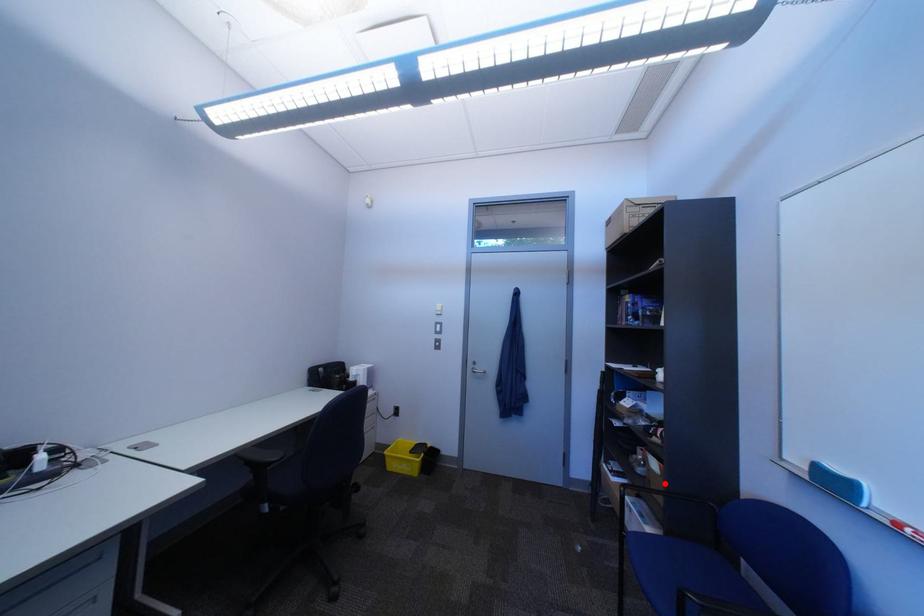
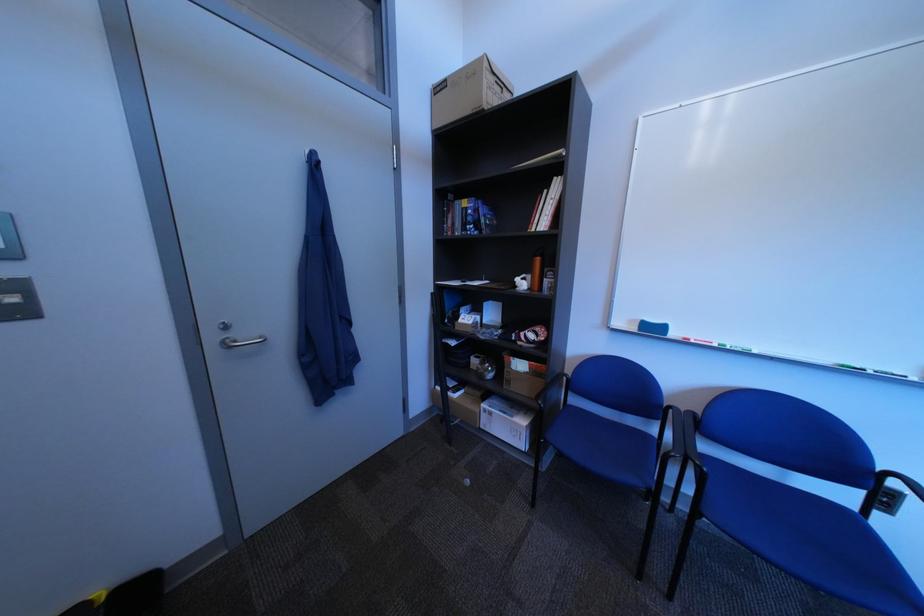
Locate, in the second image, the point that corresponds to the highlighted location in the first image.

(525, 383)